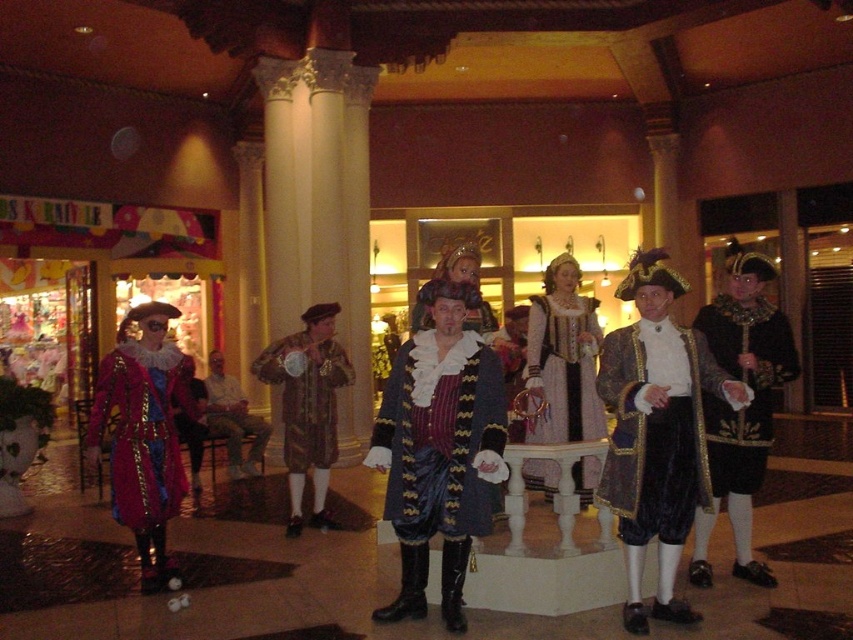
Is shiny red velvet coat at left bigger than gold brocade robe at center?

Actually, shiny red velvet coat at left might be smaller than gold brocade robe at center.

Is point (161, 474) positioned before point (706, 452)?

No, it is not.

Image resolution: width=853 pixels, height=640 pixels. In order to click on shiny red velvet coat at left in this screenshot , I will do `click(142, 429)`.

Between satin blue coat at center and velvet/gold-trimmed coat at center, which one appears on the right side from the viewer's perspective?

From the viewer's perspective, velvet/gold-trimmed coat at center appears more on the right side.

Which is below, satin blue coat at center or velvet/gold-trimmed coat at center?

velvet/gold-trimmed coat at center is below.

Between point (409, 512) and point (677, 436), which one is positioned in front?

Point (677, 436)

Identify the location of satin blue coat at center. This screenshot has width=853, height=640. coord(442,440).

Does gold brocade robe at center have a greater height compared to white satin dress at center?

In fact, gold brocade robe at center may be shorter than white satin dress at center.

Is point (767, 328) positioned in front of point (555, 371)?

Yes, it is in front of point (555, 371).

This screenshot has height=640, width=853. What do you see at coordinates (746, 384) in the screenshot?
I see `gold brocade robe at center` at bounding box center [746, 384].

The width and height of the screenshot is (853, 640). Identify the location of gold brocade robe at center. (746, 384).